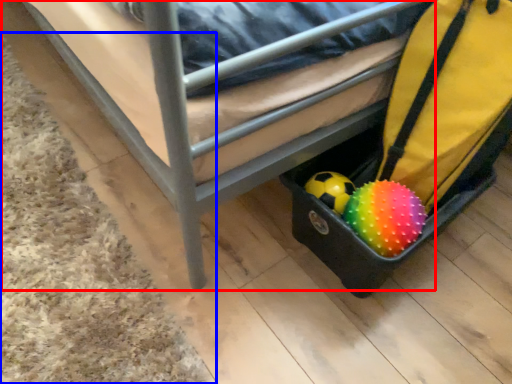
Question: Which point is further to the camera, furniture (highlighted by a red box) or mat (highlighted by a blue box)?

Choices:
 (A) furniture
 (B) mat

Answer: (B)